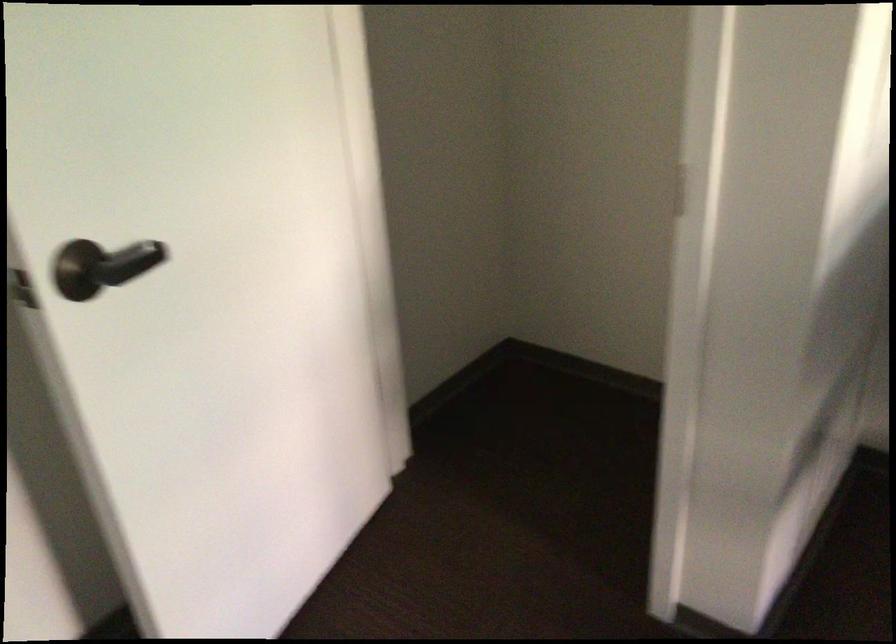
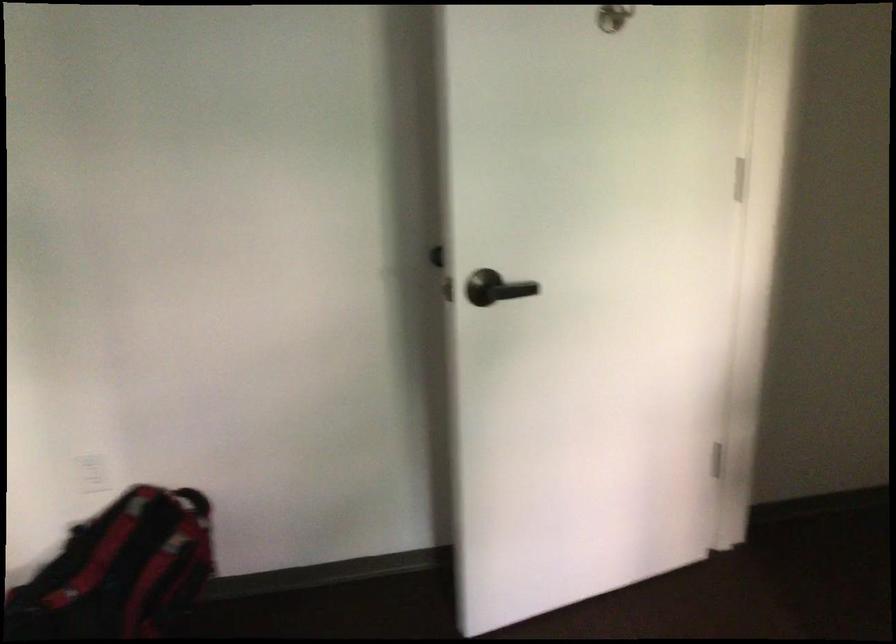
Question: The camera is either moving clockwise (left) or counter-clockwise (right) around the object. The first image is from the beginning of the video and the second image is from the end. Is the camera moving left or right when shooting the video?

Choices:
 (A) Left
 (B) Right

Answer: (B)